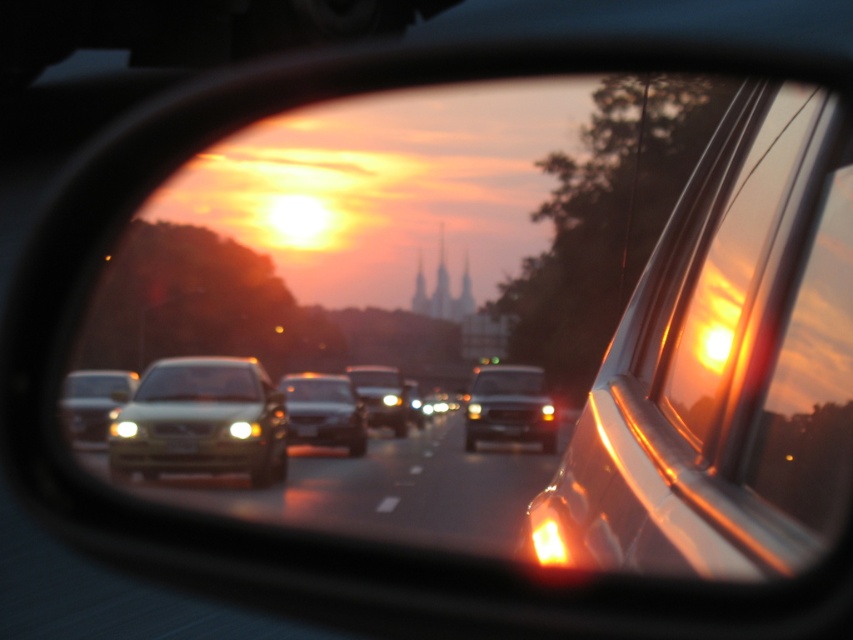
Question: Which object is closer to the camera taking this photo?

Choices:
 (A) matte silver sedan at center
 (B) satin silver sedan at center
 (C) satin gold sedan at center
 (D) matte black truck at center

Answer: (C)

Question: Is metallic silver car window at right to the left of matte black truck at center from the viewer's perspective?

Choices:
 (A) no
 (B) yes

Answer: (B)

Question: Which of the following is the farthest from the observer?

Choices:
 (A) (494, 396)
 (B) (165, 442)
 (C) (184, 376)

Answer: (A)

Question: Considering the relative positions of satin silver sedan at center and satin black sedan at center in the image provided, where is satin silver sedan at center located with respect to satin black sedan at center?

Choices:
 (A) left
 (B) right

Answer: (A)

Question: Does matte silver sedan at center have a lesser width compared to white plastic license plate at center?

Choices:
 (A) no
 (B) yes

Answer: (B)

Question: Which object is the farthest from the satin silver sedan at center?

Choices:
 (A) satin gold sedan at center
 (B) white plastic license plate at center
 (C) metallic silver car window at right

Answer: (C)